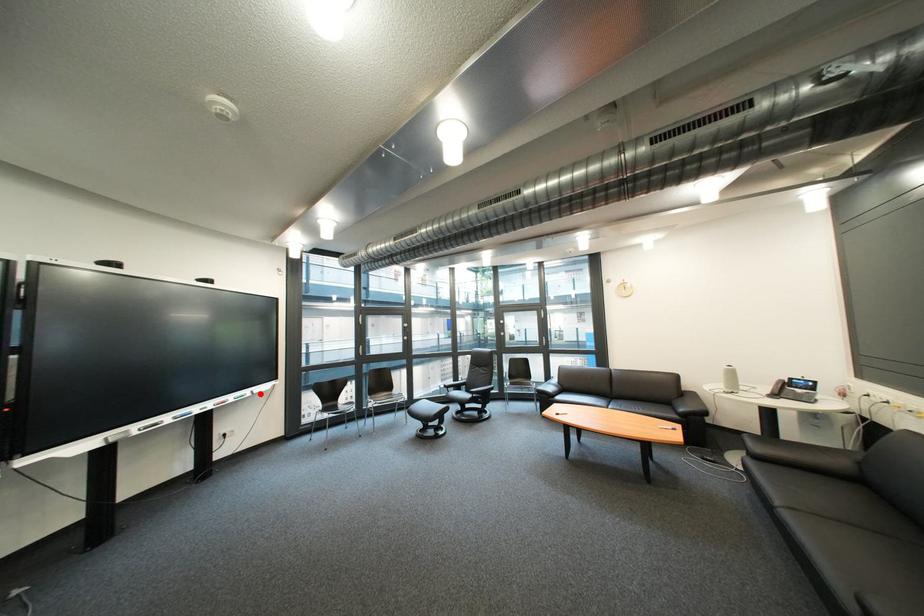
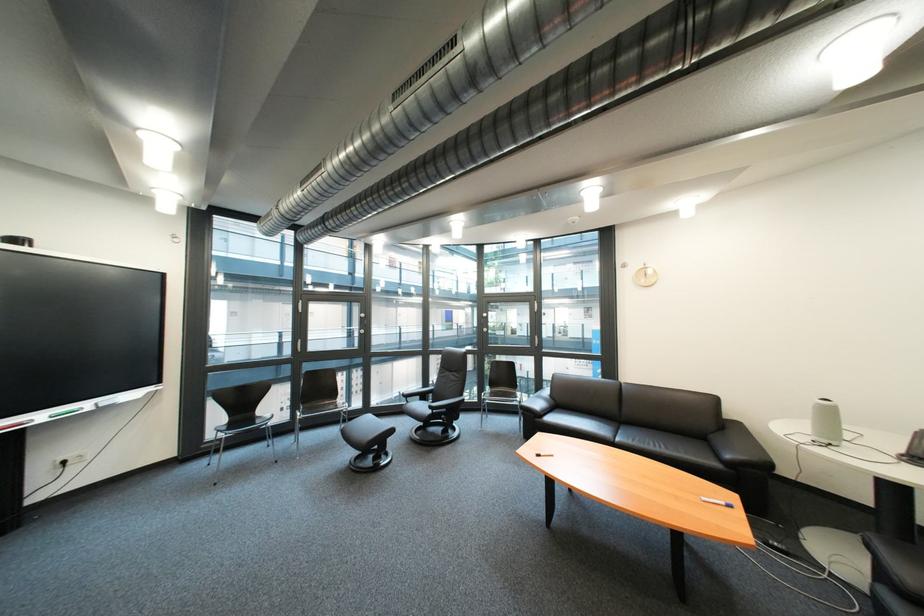
Where in the second image is the point corresponding to the highlighted location from the first image?

(101, 406)